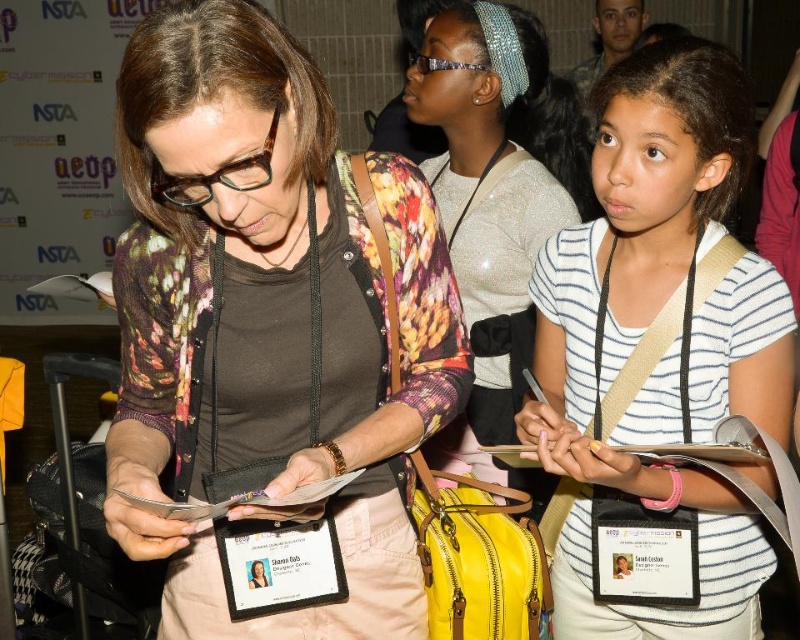
Who is shorter, floral cardigan at center or white striped shirt at center?

Standing shorter between the two is floral cardigan at center.

The image size is (800, 640). What are the coordinates of `floral cardigan at center` in the screenshot? It's located at (270, 316).

Can you confirm if white striped shirt at center is positioned above sparkly silver headband at upper center?

Actually, white striped shirt at center is below sparkly silver headband at upper center.

Describe the element at coordinates (637, 342) in the screenshot. I see `white striped shirt at center` at that location.

This screenshot has height=640, width=800. Find the location of `white striped shirt at center`. white striped shirt at center is located at coordinates (637, 342).

Is floral cardigan at center to the left of sparkly silver headband at upper center from the viewer's perspective?

Indeed, floral cardigan at center is positioned on the left side of sparkly silver headband at upper center.

What do you see at coordinates (270, 316) in the screenshot? Image resolution: width=800 pixels, height=640 pixels. I see `floral cardigan at center` at bounding box center [270, 316].

Who is more forward, (348, 627) or (524, 44)?

Positioned in front is point (348, 627).

The image size is (800, 640). What are the coordinates of `floral cardigan at center` in the screenshot? It's located at (270, 316).